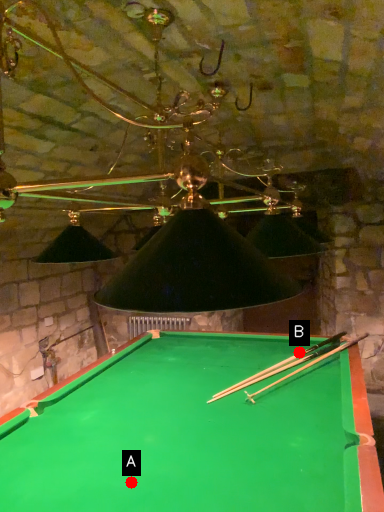
Question: Two points are circled on the image, labeled by A and B beside each circle. Which point is farther to the camera?

Choices:
 (A) A is further
 (B) B is further

Answer: (B)